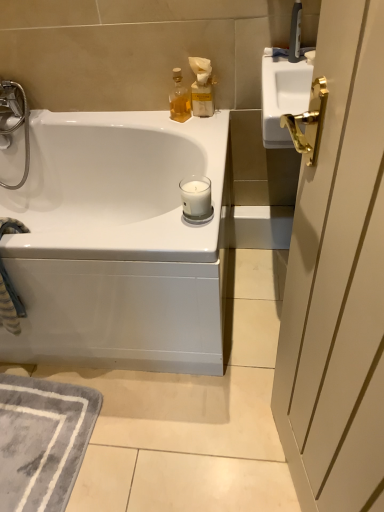
I want to click on gray soft rug at lower left, so click(x=42, y=441).

What is the approximate height of matte beige bottle at upper right?

7.93 inches.

Where is `gray soft rug at lower left`? gray soft rug at lower left is located at coordinates (42, 441).

Locate an element on the screen. This screenshot has height=512, width=384. bathtub lying in front of the gray soft rug at lower left is located at coordinates (119, 243).

Does white glossy bathtub at upper left have a greater height compared to gray soft rug at lower left?

Yes.

Is white glossy bathtub at upper left in contact with gray soft rug at lower left?

white glossy bathtub at upper left and gray soft rug at lower left are clearly separated.

Is white glossy bathtub at upper left thinner than gray soft rug at lower left?

No, white glossy bathtub at upper left is not thinner than gray soft rug at lower left.

Is translucent glass bottle at upper center taller or shorter than white glass candle at center?

Considering their sizes, translucent glass bottle at upper center has more height than white glass candle at center.

Visually, is translucent glass bottle at upper center positioned to the left or to the right of white glass candle at center?

translucent glass bottle at upper center is positioned on white glass candle at center's left side.

Can you confirm if translucent glass bottle at upper center is wider than white glass candle at center?

No, translucent glass bottle at upper center is not wider than white glass candle at center.

Which object is further away from the camera taking this photo, translucent glass bottle at upper center or white glass candle at center?

translucent glass bottle at upper center is further from the camera.

From the image's perspective, is white glass candle at center located above gray soft rug at lower left?

Correct, white glass candle at center appears higher than gray soft rug at lower left in the image.

Who is bigger, white glass candle at center or gray soft rug at lower left?

gray soft rug at lower left is bigger.

Consider the image. Which object is closer to the camera taking this photo, white glass candle at center or gray soft rug at lower left?

white glass candle at center is more forward.

Does white glass candle at center touch gray soft rug at lower left?

white glass candle at center and gray soft rug at lower left are clearly separated.

How far apart are white glossy bathtub at upper left and matte beige bottle at upper right?

A distance of 22.22 inches exists between white glossy bathtub at upper left and matte beige bottle at upper right.

Is matte beige bottle at upper right inside white glossy bathtub at upper left?

No, matte beige bottle at upper right is not a part of white glossy bathtub at upper left.

Find the location of a particular element. Image resolution: width=384 pixels, height=512 pixels. bathtub located in front of the matte beige bottle at upper right is located at coordinates (119, 243).

Is white glossy bathtub at upper left touching matte beige bottle at upper right?

No.

From a real-world perspective, is white glass candle at center physically located above or below translucent glass bottle at upper center?

In terms of real-world spatial position, white glass candle at center is below translucent glass bottle at upper center.

Where is `soap dispenser above the white glass candle at center (from the image's perspective)`? Image resolution: width=384 pixels, height=512 pixels. soap dispenser above the white glass candle at center (from the image's perspective) is located at coordinates (x=179, y=99).

Can you confirm if white glass candle at center is thinner than translucent glass bottle at upper center?

In fact, white glass candle at center might be wider than translucent glass bottle at upper center.

Is there a large distance between white glass candle at center and translucent glass bottle at upper center?

That's not correct — white glass candle at center is a little close to translucent glass bottle at upper center.

Can you confirm if gray soft rug at lower left is taller than white glossy bathtub at upper left?

No.

Is gray soft rug at lower left looking in the opposite direction of white glossy bathtub at upper left?

No, white glossy bathtub at upper left is not at the back of gray soft rug at lower left.

Can white glossy bathtub at upper left be found inside gray soft rug at lower left?

No, gray soft rug at lower left does not contain white glossy bathtub at upper left.

Which is nearer, (34, 398) or (107, 133)?

The point (34, 398) is closer to the camera.

In the image, is matte beige bottle at upper right positioned in front of or behind white glossy bathtub at upper left?

matte beige bottle at upper right is behind white glossy bathtub at upper left.

Considering the sizes of objects matte beige bottle at upper right and white glossy bathtub at upper left in the image provided, who is taller, matte beige bottle at upper right or white glossy bathtub at upper left?

white glossy bathtub at upper left is taller.

From the image's perspective, is matte beige bottle at upper right positioned above or below white glossy bathtub at upper left?

From the image's perspective, matte beige bottle at upper right appears above white glossy bathtub at upper left.

Identify the location of bathtub that appears on the right of gray soft rug at lower left. The width and height of the screenshot is (384, 512). (119, 243).

Where is `soap dispenser that appears above the white glass candle at center (from the image's perspective)`? soap dispenser that appears above the white glass candle at center (from the image's perspective) is located at coordinates (179, 99).

From the image, which object appears to be nearer to translucent glass bottle at upper center, matte beige bottle at upper right or white glass candle at center?

Based on the image, matte beige bottle at upper right appears to be nearer to translucent glass bottle at upper center.

Estimate the real-world distances between objects in this image. Which object is closer to white glass candle at center, matte beige bottle at upper right or translucent glass bottle at upper center?

translucent glass bottle at upper center lies closer to white glass candle at center than the other object.

Estimate the real-world distances between objects in this image. Which object is further from white glossy bathtub at upper left, gray soft rug at lower left or white glass candle at center?

Among the two, white glass candle at center is located further to white glossy bathtub at upper left.

Estimate the real-world distances between objects in this image. Which object is further from translucent glass bottle at upper center, white glass candle at center or gray soft rug at lower left?

Based on the image, gray soft rug at lower left appears to be further to translucent glass bottle at upper center.

When comparing their distances from white glass candle at center, does matte beige bottle at upper right or gray soft rug at lower left seem closer?

matte beige bottle at upper right is closer to white glass candle at center.

Estimate the real-world distances between objects in this image. Which object is further from gray soft rug at lower left, white glossy bathtub at upper left or white glass candle at center?

Among the two, white glass candle at center is located further to gray soft rug at lower left.

Based on their spatial positions, is gray soft rug at lower left or translucent glass bottle at upper center further from white glass candle at center?

gray soft rug at lower left.

When comparing their distances from gray soft rug at lower left, does white glossy bathtub at upper left or matte beige bottle at upper right seem closer?

white glossy bathtub at upper left is closer to gray soft rug at lower left.

At what (x,y) coordinates should I click in order to perform the action: click on candle between matte beige bottle at upper right and white glossy bathtub at upper left in the vertical direction. Please return your answer as a coordinate pair (x, y). Looking at the image, I should click on (196, 197).

The height and width of the screenshot is (512, 384). I want to click on candle between translucent glass bottle at upper center and white glossy bathtub at upper left vertically, so click(196, 197).

The width and height of the screenshot is (384, 512). In order to click on candle between translucent glass bottle at upper center and gray soft rug at lower left in the up-down direction in this screenshot , I will do `click(196, 197)`.

I want to click on soap dispenser between matte beige bottle at upper right and white glossy bathtub at upper left in the vertical direction, so click(179, 99).